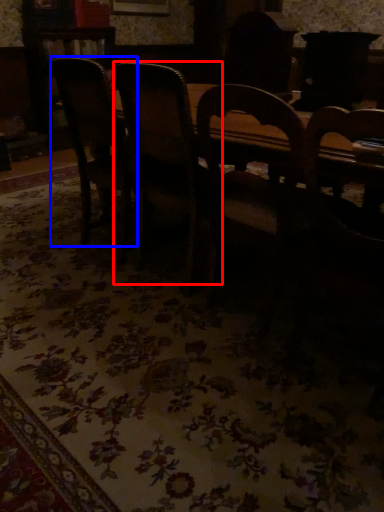
Question: Which point is closer to the camera, chair (highlighted by a red box) or chair (highlighted by a blue box)?

Choices:
 (A) chair
 (B) chair

Answer: (A)